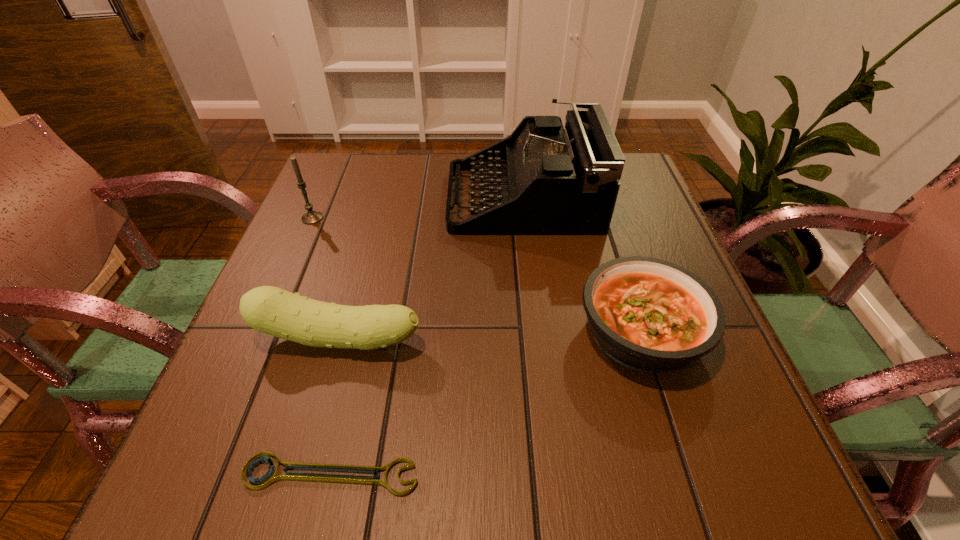
The image size is (960, 540). I want to click on object that is at the near left corner, so click(270, 477).

What are the coordinates of `object situated at the far right corner` in the screenshot? It's located at (549, 180).

Where is `vacant region at the far edge`? vacant region at the far edge is located at coordinates (423, 162).

The image size is (960, 540). What are the coordinates of `vacant area at the near edge of the desktop` in the screenshot? It's located at (299, 457).

At what (x,y) coordinates should I click in order to perform the action: click on vacant space at the left edge. Please return your answer as a coordinate pair (x, y). Image resolution: width=960 pixels, height=540 pixels. Looking at the image, I should click on (304, 262).

This screenshot has width=960, height=540. Find the location of `vacant space at the right edge`. vacant space at the right edge is located at coordinates (668, 233).

I want to click on blank space at the far left corner, so click(x=343, y=179).

The height and width of the screenshot is (540, 960). I want to click on vacant space at the near right corner of the desktop, so click(774, 471).

This screenshot has width=960, height=540. What are the coordinates of `free space between the typewriter and the candle` in the screenshot? It's located at (418, 208).

Find the location of `vacant space that is in between the typewriter and the wrench`. vacant space that is in between the typewriter and the wrench is located at coordinates pos(427,336).